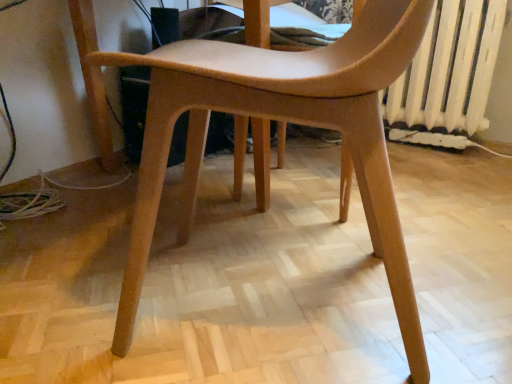
Question: Is point (468, 97) positioned closer to the camera than point (186, 183)?

Choices:
 (A) farther
 (B) closer

Answer: (A)

Question: From the image's perspective, relative to matte wood chair at center, is white painted metal radiator at right above or below?

Choices:
 (A) above
 (B) below

Answer: (A)

Question: In the image, is white painted metal radiator at right positioned in front of or behind matte wood chair at center?

Choices:
 (A) front
 (B) behind

Answer: (B)

Question: Is matte wood chair at center bigger or smaller than white painted metal radiator at right?

Choices:
 (A) small
 (B) big

Answer: (B)

Question: From a real-world perspective, relative to white painted metal radiator at right, is matte wood chair at center vertically above or below?

Choices:
 (A) above
 (B) below

Answer: (B)

Question: From their relative heights in the image, would you say matte wood chair at center is taller or shorter than white painted metal radiator at right?

Choices:
 (A) short
 (B) tall

Answer: (B)

Question: Considering the positions of point (83, 6) and point (473, 112), is point (83, 6) closer or farther from the camera than point (473, 112)?

Choices:
 (A) farther
 (B) closer

Answer: (B)